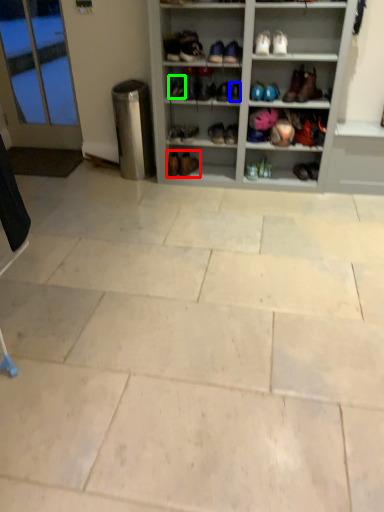
Question: Based on their relative distances, which object is nearer to footwear (highlighted by a red box)? Choose from shoe (highlighted by a blue box) and shoe (highlighted by a green box).

Choices:
 (A) shoe
 (B) shoe

Answer: (B)